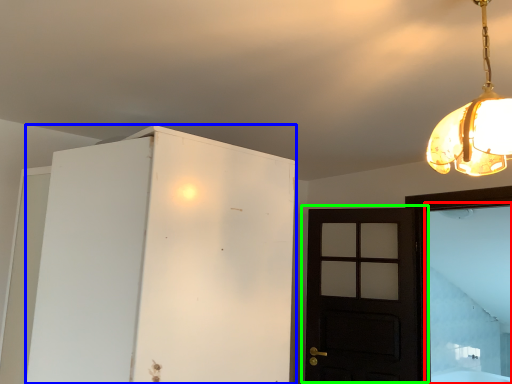
Question: Based on their relative distances, which object is farther from window (highlighted by a red box)? Choose from cabinetry (highlighted by a blue box) and door (highlighted by a green box).

Choices:
 (A) cabinetry
 (B) door

Answer: (A)